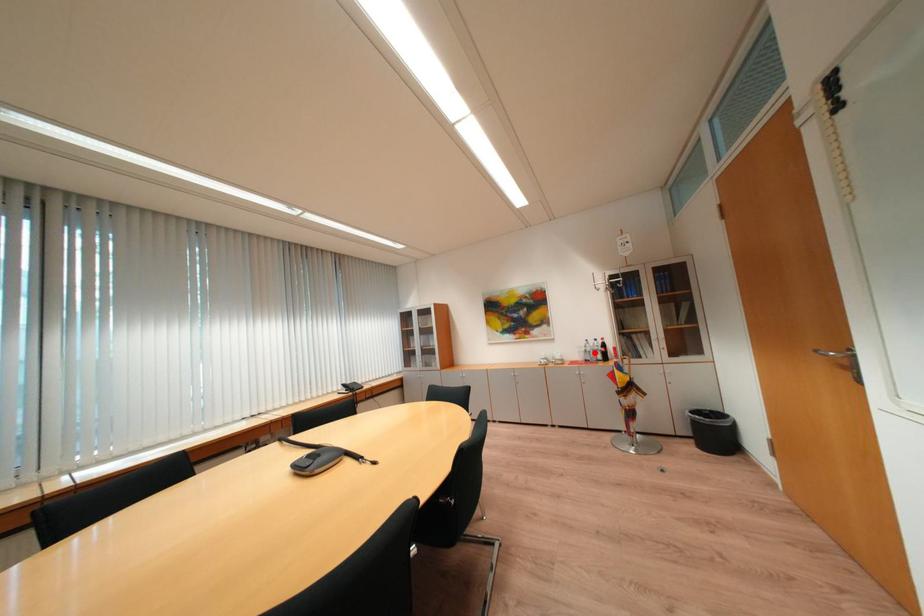
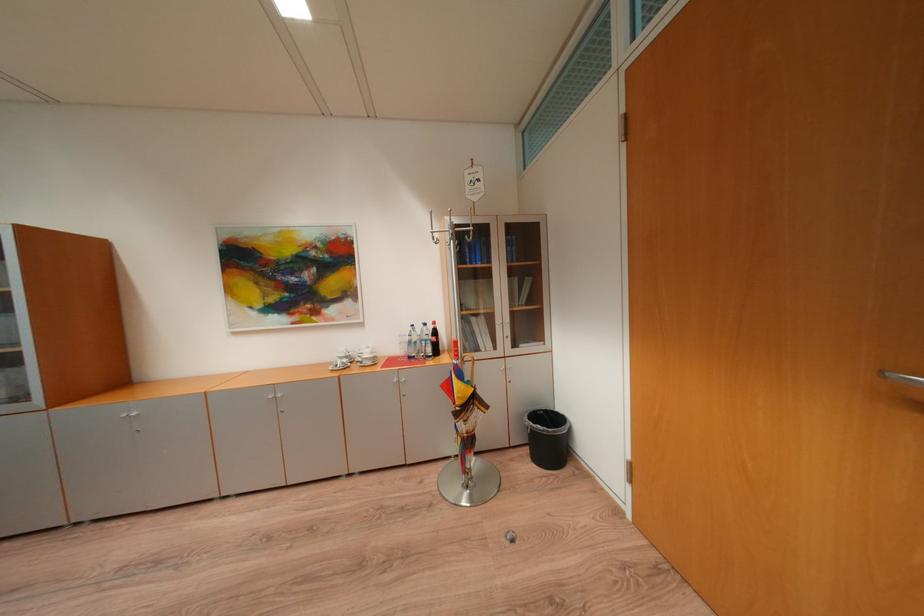
Question: I am providing you with two images of the same scene from different viewpoints. A red point is shown in image1. For the corresponding object point in image2, is it positioned nearer or farther from the camera?

Choices:
 (A) Nearer
 (B) Farther

Answer: (A)